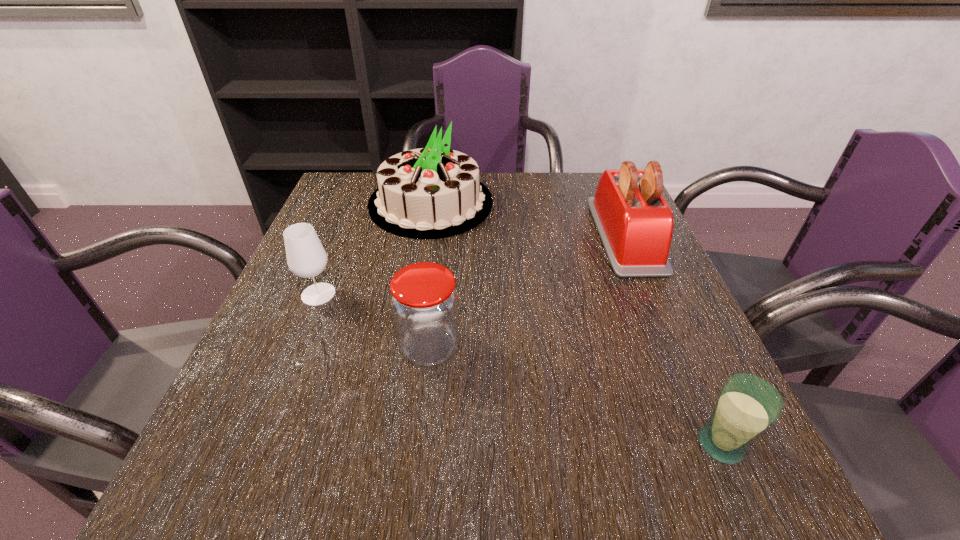
Locate an element on the screen. The height and width of the screenshot is (540, 960). birthday cake is located at coordinates (435, 192).

You are a GUI agent. You are given a task and a screenshot of the screen. Output one action in this format:
    pyautogui.click(x=<x>, y=<y>)
    Task: Click on the toaster
    
    Given the screenshot: What is the action you would take?
    pyautogui.click(x=635, y=223)

Image resolution: width=960 pixels, height=540 pixels. What are the coordinates of `jar` in the screenshot? It's located at (424, 302).

Locate an element on the screen. The height and width of the screenshot is (540, 960). the third farthest object is located at coordinates (306, 257).

The height and width of the screenshot is (540, 960). I want to click on the taller glass, so click(x=306, y=257).

You are a GUI agent. You are given a task and a screenshot of the screen. Output one action in this format:
    pyautogui.click(x=<x>, y=<y>)
    Task: Click on the shorter glass
    The image size is (960, 540).
    Given the screenshot: What is the action you would take?
    pyautogui.click(x=747, y=406)

Locate an element on the screen. Image resolution: width=960 pixels, height=540 pixels. the nearest object is located at coordinates (747, 406).

Where is `vacant space located 0.060m on the front of the birthday cake`? vacant space located 0.060m on the front of the birthday cake is located at coordinates (422, 255).

You are a GUI agent. You are given a task and a screenshot of the screen. Output one action in this format:
    pyautogui.click(x=<x>, y=<y>)
    Task: Click on the vacant space located 0.160m on the front of the toaster
    This screenshot has height=540, width=960.
    Given the screenshot: What is the action you would take?
    667,334

I want to click on vacant space located on the right of the jar, so click(579, 347).